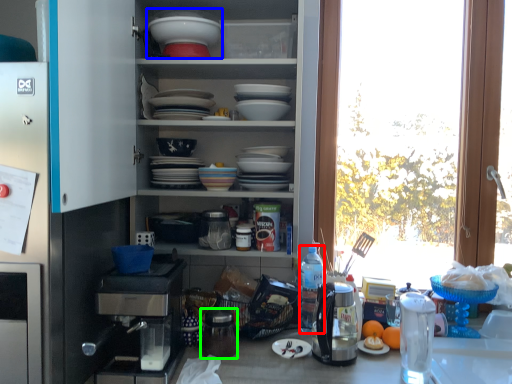
Question: Based on their relative distances, which object is nearer to bottle (highlighted by a red box)? Choose from appliance (highlighted by a blue box) and appliance (highlighted by a green box).

Choices:
 (A) appliance
 (B) appliance

Answer: (B)